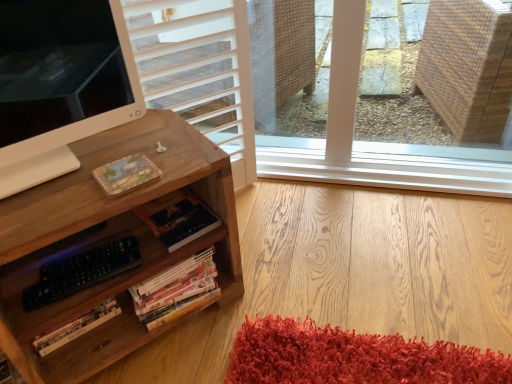
Question: From the image's perspective, would you say wooden desk at left is shown under hardcover book at center, the 1th book viewed from the top?

Choices:
 (A) yes
 (B) no

Answer: (A)

Question: From the image's perspective, is wooden desk at left over hardcover book at center, the 1th book viewed from the top?

Choices:
 (A) no
 (B) yes

Answer: (A)

Question: Is wooden desk at left thinner than hardcover book at center, the 2th book in the bottom-to-top sequence?

Choices:
 (A) yes
 (B) no

Answer: (B)

Question: Can you confirm if wooden desk at left is smaller than hardcover book at center, the 1th book viewed from the top?

Choices:
 (A) yes
 (B) no

Answer: (B)

Question: Is wooden desk at left aimed at hardcover book at center, the 1th book viewed from the top?

Choices:
 (A) yes
 (B) no

Answer: (A)

Question: Is wooden desk at left not inside hardcover book at center, the 2th book in the bottom-to-top sequence?

Choices:
 (A) no
 (B) yes

Answer: (B)

Question: Does hardcover books at lower center, marked as the 1th book in a bottom-to-top arrangement, have a smaller size compared to wooden desk at left?

Choices:
 (A) yes
 (B) no

Answer: (A)

Question: Is hardcover books at lower center, which is counted as the 2th book, starting from the top, at the right side of wooden desk at left?

Choices:
 (A) no
 (B) yes

Answer: (B)

Question: From a real-world perspective, is hardcover books at lower center, marked as the 1th book in a bottom-to-top arrangement, located beneath wooden desk at left?

Choices:
 (A) yes
 (B) no

Answer: (A)

Question: Considering the relative positions of hardcover books at lower center, marked as the 1th book in a bottom-to-top arrangement, and wooden desk at left in the image provided, is hardcover books at lower center, marked as the 1th book in a bottom-to-top arrangement, behind wooden desk at left?

Choices:
 (A) yes
 (B) no

Answer: (A)

Question: From the image's perspective, does hardcover books at lower center, marked as the 1th book in a bottom-to-top arrangement, appear higher than wooden desk at left?

Choices:
 (A) no
 (B) yes

Answer: (A)

Question: Would you say hardcover books at lower center, which is counted as the 2th book, starting from the top, contains wooden desk at left?

Choices:
 (A) no
 (B) yes

Answer: (A)

Question: Does hardcover book at center, the 1th book viewed from the top, touch hardcover books at lower center, which is counted as the 2th book, starting from the top?

Choices:
 (A) no
 (B) yes

Answer: (A)